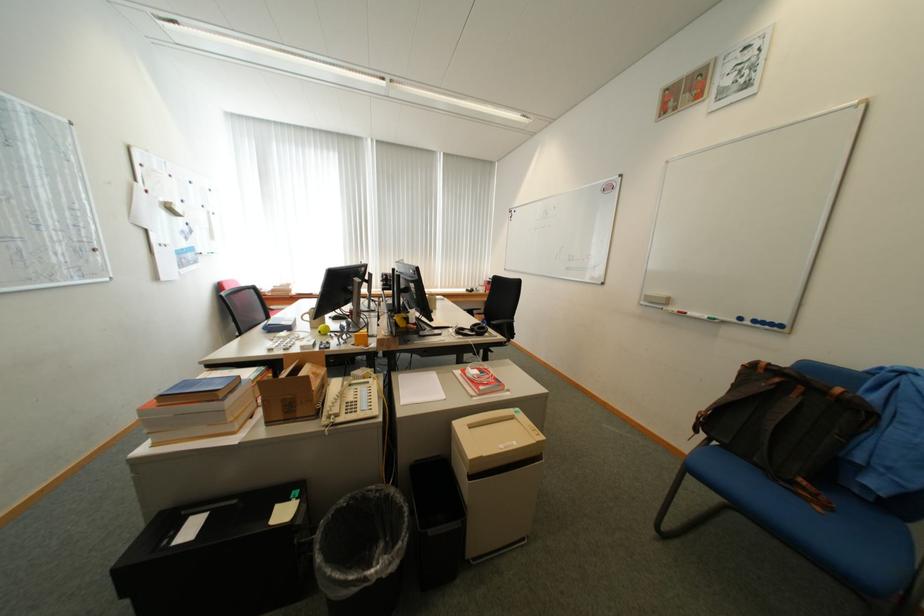
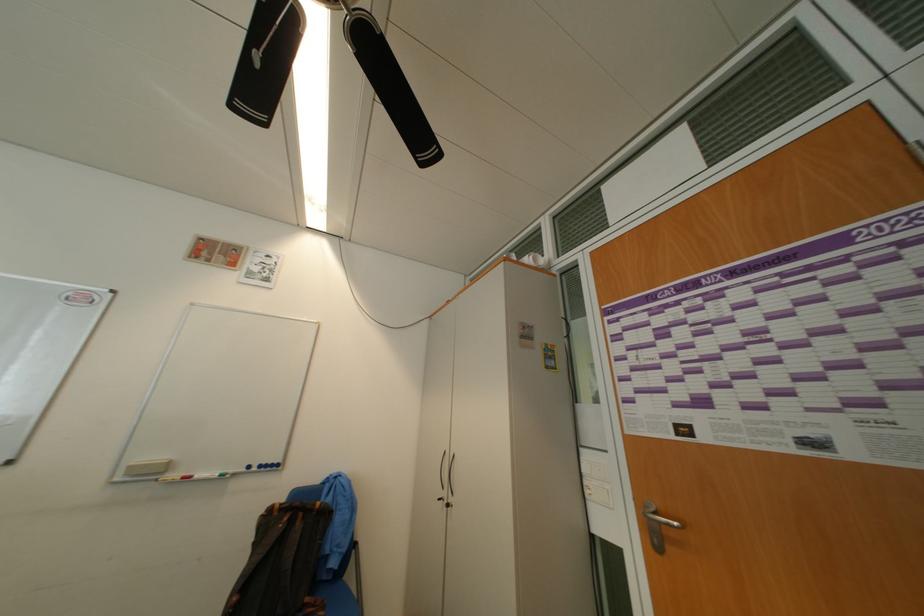
The point at (x=837, y=509) is marked in the first image. Where is the corresponding point in the second image?

(334, 609)